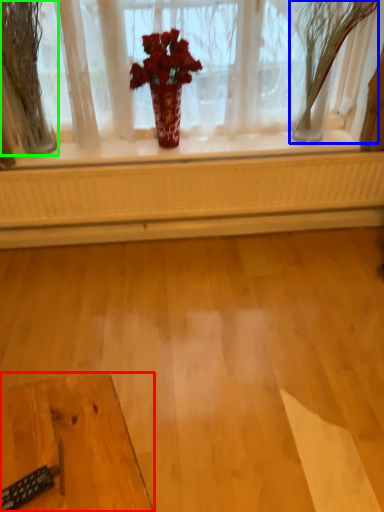
Question: Which is nearer to the table (highlighted by a red box)? tree (highlighted by a blue box) or tree (highlighted by a green box).

Choices:
 (A) tree
 (B) tree

Answer: (B)